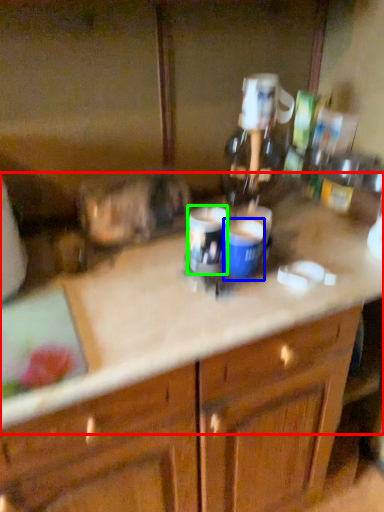
Question: Considering the real-world distances, which object is closest to counter top (highlighted by a red box)? beverage (highlighted by a blue box) or beverage (highlighted by a green box).

Choices:
 (A) beverage
 (B) beverage

Answer: (B)